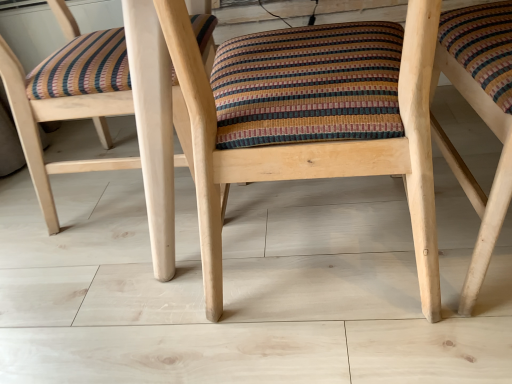
Where is `wooden chair at center, which appears as the 2th chair when viewed from the left`? The height and width of the screenshot is (384, 512). wooden chair at center, which appears as the 2th chair when viewed from the left is located at coordinates (310, 120).

I want to click on wooden chair at center, positioned as the 2th chair in right-to-left order, so click(x=310, y=120).

Considering the positions of points (228, 135) and (440, 37), is point (228, 135) closer to camera compared to point (440, 37)?

Yes, it is in front of point (440, 37).

From a real-world perspective, who is located lower, wooden chair at center, positioned as the 2th chair in right-to-left order, or natural wood chair at center, the 3th chair when ordered from left to right?

natural wood chair at center, the 3th chair when ordered from left to right, from a real-world perspective.

Locate an element on the screen. The width and height of the screenshot is (512, 384). the 1st chair counting from the left side of the natural wood chair at center, the 3th chair when ordered from left to right is located at coordinates (310, 120).

Considering the relative sizes of wooden chair at center, which appears as the 2th chair when viewed from the left, and natural wood chair at center, the 3th chair when ordered from left to right, in the image provided, is wooden chair at center, which appears as the 2th chair when viewed from the left, bigger than natural wood chair at center, the 3th chair when ordered from left to right,?

Correct, wooden chair at center, which appears as the 2th chair when viewed from the left, is larger in size than natural wood chair at center, the 3th chair when ordered from left to right.

Choose the correct answer: Is natural wood chair at center, the 1th chair viewed from the right, inside wooden chair at center, marked as the first chair in a left-to-right arrangement, or outside it?

natural wood chair at center, the 1th chair viewed from the right, is not enclosed by wooden chair at center, marked as the first chair in a left-to-right arrangement.

Is point (446, 157) positioned behind point (151, 29)?

Yes, point (446, 157) is farther from viewer.

Is natural wood chair at center, the 1th chair viewed from the right, positioned before wooden chair at center, positioned as the 3th chair in right-to-left order?

Yes, it is in front of wooden chair at center, positioned as the 3th chair in right-to-left order.

From the image's perspective, which one is positioned higher, natural wood chair at center, the 3th chair when ordered from left to right, or wooden chair at center, positioned as the 3th chair in right-to-left order?

From the image's view, wooden chair at center, positioned as the 3th chair in right-to-left order, is above.

Considering the points (161, 42) and (245, 173), which point is in front, point (161, 42) or point (245, 173)?

Point (245, 173)

Is wooden chair at center, marked as the first chair in a left-to-right arrangement, positioned with its back to wooden chair at center, which appears as the 2th chair when viewed from the left?

No, wooden chair at center, which appears as the 2th chair when viewed from the left, is not at the back of wooden chair at center, marked as the first chair in a left-to-right arrangement.

Which is more to the left, wooden chair at center, marked as the first chair in a left-to-right arrangement, or wooden chair at center, positioned as the 2th chair in right-to-left order?

From the viewer's perspective, wooden chair at center, marked as the first chair in a left-to-right arrangement, appears more on the left side.

This screenshot has height=384, width=512. What are the coordinates of `chair that appears on the left of wooden chair at center, positioned as the 2th chair in right-to-left order` in the screenshot? It's located at (108, 133).

Considering the positions of points (425, 120) and (159, 276), is point (425, 120) farther from camera compared to point (159, 276)?

No.

Is wooden chair at center, positioned as the 2th chair in right-to-left order, thinner than wooden chair at center, positioned as the 3th chair in right-to-left order?

In fact, wooden chair at center, positioned as the 2th chair in right-to-left order, might be wider than wooden chair at center, positioned as the 3th chair in right-to-left order.

From the picture: Are wooden chair at center, positioned as the 2th chair in right-to-left order, and wooden chair at center, positioned as the 3th chair in right-to-left order, located far from each other?

wooden chair at center, positioned as the 2th chair in right-to-left order, is near wooden chair at center, positioned as the 3th chair in right-to-left order, not far away.

Which chair is the 2nd one when counting from the back of the wooden chair at center, positioned as the 2th chair in right-to-left order? Please provide its 2D coordinates.

[(108, 133)]

From the image's perspective, is natural wood chair at center, the 3th chair when ordered from left to right, located above or below wooden chair at center, which appears as the 2th chair when viewed from the left?

Based on their image positions, natural wood chair at center, the 3th chair when ordered from left to right, is located above wooden chair at center, which appears as the 2th chair when viewed from the left.

Measure the distance from natural wood chair at center, the 3th chair when ordered from left to right, to wooden chair at center, which appears as the 2th chair when viewed from the left.

natural wood chair at center, the 3th chair when ordered from left to right, is 11.26 inches from wooden chair at center, which appears as the 2th chair when viewed from the left.

Which of these two, natural wood chair at center, the 3th chair when ordered from left to right, or wooden chair at center, which appears as the 2th chair when viewed from the left, is bigger?

Bigger between the two is wooden chair at center, which appears as the 2th chair when viewed from the left.

Can you see natural wood chair at center, the 1th chair viewed from the right, touching wooden chair at center, positioned as the 2th chair in right-to-left order?

No, natural wood chair at center, the 1th chair viewed from the right, is not with wooden chair at center, positioned as the 2th chair in right-to-left order.

From the image's perspective, between wooden chair at center, positioned as the 3th chair in right-to-left order, and natural wood chair at center, the 3th chair when ordered from left to right, who is located below?

natural wood chair at center, the 3th chair when ordered from left to right, appears lower in the image.

Which of these two, wooden chair at center, positioned as the 3th chair in right-to-left order, or natural wood chair at center, the 3th chair when ordered from left to right, is thinner?

With smaller width is wooden chair at center, positioned as the 3th chair in right-to-left order.

From a real-world perspective, between wooden chair at center, positioned as the 3th chair in right-to-left order, and natural wood chair at center, the 3th chair when ordered from left to right, who is vertically lower?

natural wood chair at center, the 3th chair when ordered from left to right, is physically lower.

The image size is (512, 384). I want to click on the 1st chair above the wooden chair at center, positioned as the 2th chair in right-to-left order (from the image's perspective), so click(479, 115).

The width and height of the screenshot is (512, 384). What are the coordinates of `the 2nd chair to the left when counting from the natural wood chair at center, the 1th chair viewed from the right` in the screenshot? It's located at (108, 133).

Which object lies nearer to the anchor point wooden chair at center, marked as the first chair in a left-to-right arrangement, wooden chair at center, positioned as the 2th chair in right-to-left order, or natural wood chair at center, the 3th chair when ordered from left to right?

wooden chair at center, positioned as the 2th chair in right-to-left order, is positioned closer to the anchor wooden chair at center, marked as the first chair in a left-to-right arrangement.

Based on their spatial positions, is natural wood chair at center, the 1th chair viewed from the right, or wooden chair at center, marked as the first chair in a left-to-right arrangement, further from wooden chair at center, positioned as the 2th chair in right-to-left order?

Based on the image, natural wood chair at center, the 1th chair viewed from the right, appears to be further to wooden chair at center, positioned as the 2th chair in right-to-left order.

Based on the photo, when comparing their distances from natural wood chair at center, the 1th chair viewed from the right, does wooden chair at center, which appears as the 2th chair when viewed from the left, or wooden chair at center, marked as the first chair in a left-to-right arrangement, seem further?

wooden chair at center, marked as the first chair in a left-to-right arrangement, lies further to natural wood chair at center, the 1th chair viewed from the right, than the other object.

Estimate the real-world distances between objects in this image. Which object is further from wooden chair at center, which appears as the 2th chair when viewed from the left, wooden chair at center, marked as the first chair in a left-to-right arrangement, or natural wood chair at center, the 3th chair when ordered from left to right?

natural wood chair at center, the 3th chair when ordered from left to right, is further to wooden chair at center, which appears as the 2th chair when viewed from the left.

Based on their spatial positions, is wooden chair at center, positioned as the 3th chair in right-to-left order, or wooden chair at center, which appears as the 2th chair when viewed from the left, closer to natural wood chair at center, the 3th chair when ordered from left to right?

The object closer to natural wood chair at center, the 3th chair when ordered from left to right, is wooden chair at center, which appears as the 2th chair when viewed from the left.

When comparing their distances from wooden chair at center, positioned as the 3th chair in right-to-left order, does natural wood chair at center, the 1th chair viewed from the right, or wooden chair at center, positioned as the 2th chair in right-to-left order, seem closer?

wooden chair at center, positioned as the 2th chair in right-to-left order.

At what (x,y) coordinates should I click in order to perform the action: click on chair located between wooden chair at center, marked as the first chair in a left-to-right arrangement, and natural wood chair at center, the 1th chair viewed from the right, in the left-right direction. Please return your answer as a coordinate pair (x, y). The image size is (512, 384). Looking at the image, I should click on pyautogui.click(x=310, y=120).